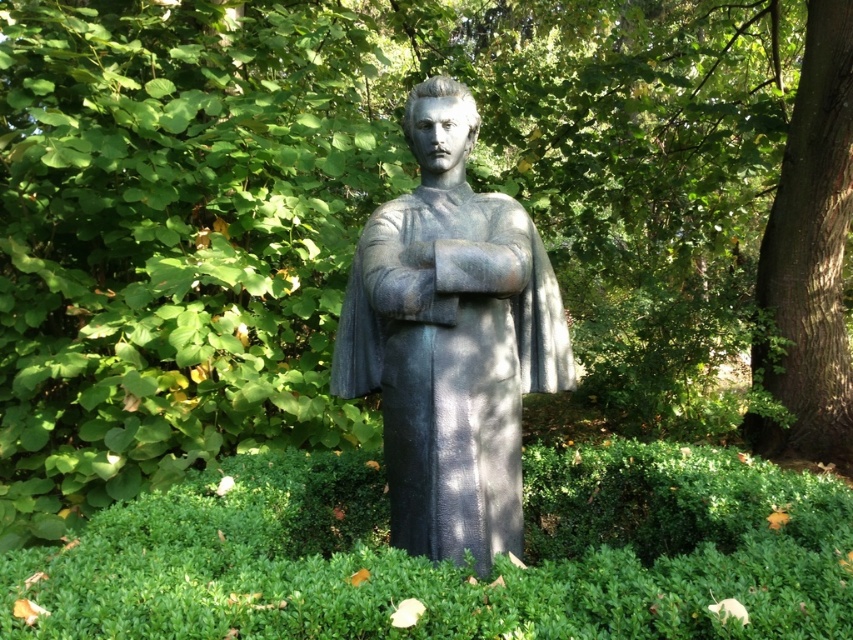
Question: Where is gray stone statue at center located in relation to smooth brown bark at right in the image?

Choices:
 (A) below
 (B) above

Answer: (A)

Question: Does gray stone statue at center have a greater width compared to smooth brown bark at right?

Choices:
 (A) no
 (B) yes

Answer: (B)

Question: Which of the following is the closest to the observer?

Choices:
 (A) pyautogui.click(x=845, y=385)
 (B) pyautogui.click(x=502, y=515)

Answer: (B)

Question: Is gray stone statue at center above smooth brown bark at right?

Choices:
 (A) no
 (B) yes

Answer: (A)

Question: Which of the following is the closest to the observer?

Choices:
 (A) gray stone statue at center
 (B) smooth brown bark at right

Answer: (A)